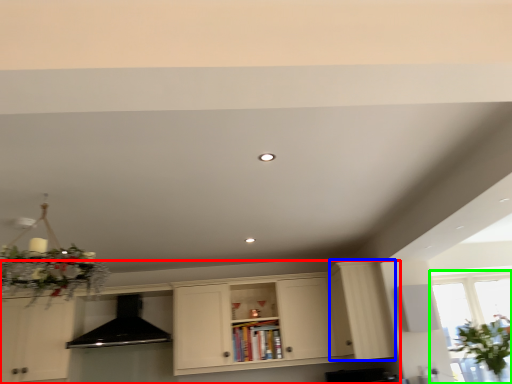
Question: Which object is the farthest from cabinetry (highlighted by a red box)? Choose among these: cabinetry (highlighted by a blue box) or window (highlighted by a green box).

Choices:
 (A) cabinetry
 (B) window

Answer: (B)